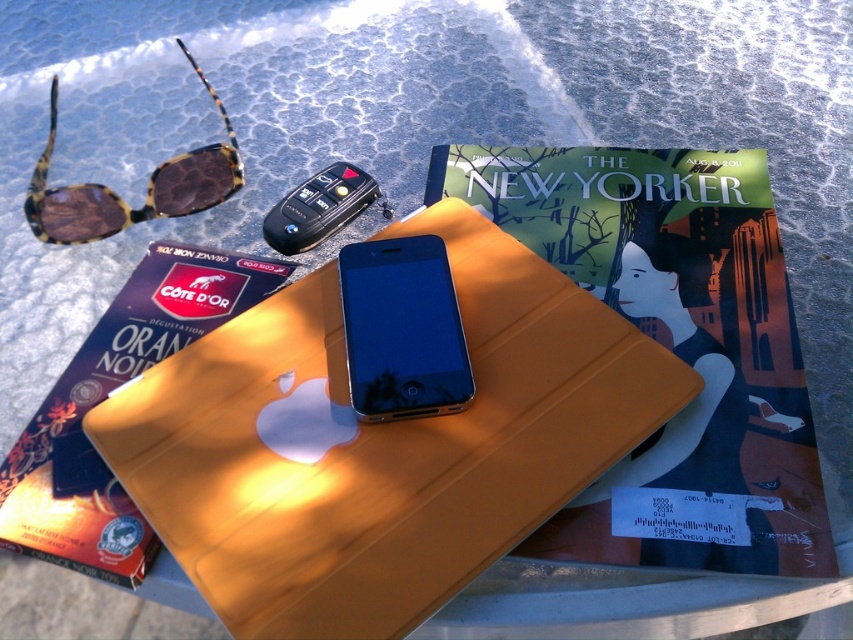
Between matte paper book at center and black glossy smartphone at center, which one has more height?

matte paper book at center

Is matte paper book at center to the right of black glossy smartphone at center from the viewer's perspective?

Indeed, matte paper book at center is positioned on the right side of black glossy smartphone at center.

Is point (730, 381) positioned before point (346, 333)?

No, it is not.

At what (x,y) coordinates should I click in order to perform the action: click on matte paper book at center. Please return your answer as a coordinate pair (x, y). The width and height of the screenshot is (853, 640). Looking at the image, I should click on (674, 348).

Which of these two, matte orange tablet case at center or tortoiseshell acetate sunglasses at upper left, stands shorter?

Standing shorter between the two is tortoiseshell acetate sunglasses at upper left.

This screenshot has width=853, height=640. I want to click on matte orange tablet case at center, so click(103, 397).

What are the coordinates of `matte orange tablet case at center` in the screenshot? It's located at (103, 397).

Which is in front, point (421, 282) or point (173, 196)?

Point (421, 282) is more forward.

Is black glossy smartphone at center below tortoiseshell acetate sunglasses at upper left?

Correct, black glossy smartphone at center is located below tortoiseshell acetate sunglasses at upper left.

Who is more distant from viewer, (364, 417) or (225, 147)?

The point (225, 147) is more distant.

Identify the location of black glossy smartphone at center. This screenshot has width=853, height=640. (402, 330).